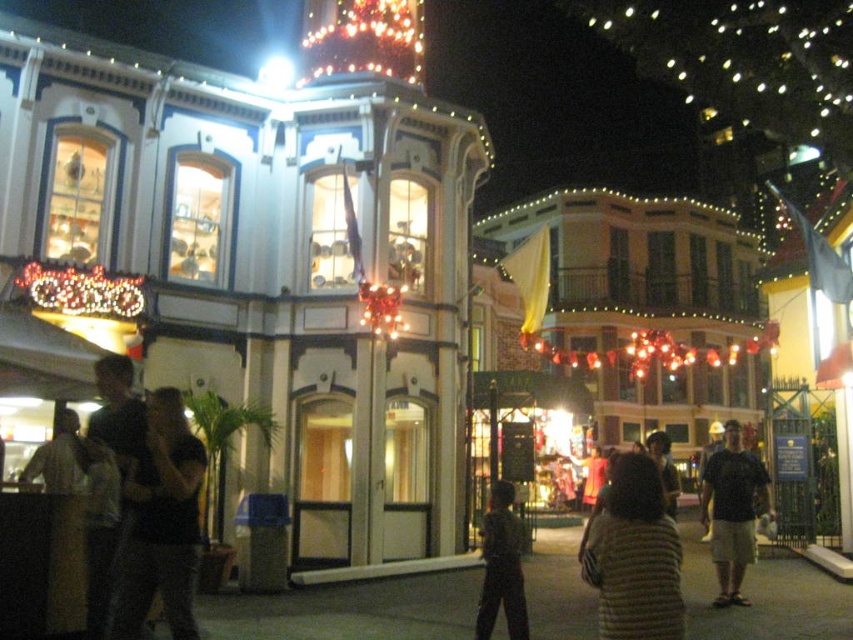
You are standing in the festive urban area and want to move from the point closer to you to the point further away. Which path should you take between the two points, point (728, 484) and point (519, 589)?

The point further to the viewer is point (728, 484), so to move from the closer point to the further one, you should go from point (519, 589) to point (728, 484).

You are standing in the festive urban area and want to take a photo of both the point at location (401, 26) and the point at (756, 458). Which point should you focus on first to ensure both are in focus?

You should focus on the point at (401, 26) first because it is closer to the camera than the point at (756, 458). This way, the depth of field will cover both points effectively.